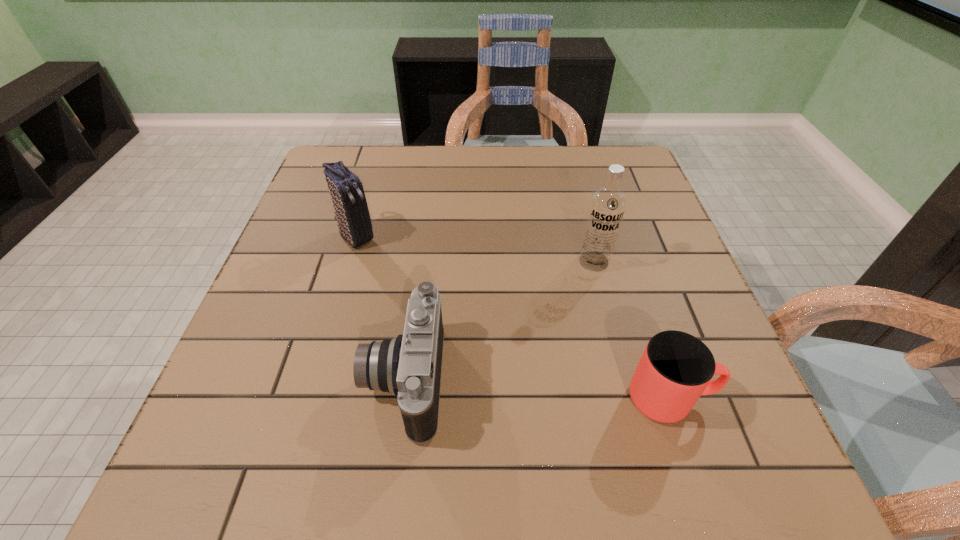
The width and height of the screenshot is (960, 540). Find the location of `free space that is in between the tallest object and the cup`. free space that is in between the tallest object and the cup is located at coordinates (632, 330).

Identify the location of free point between the leftmost object and the shortest object. (514, 318).

Find the location of a particular element. free spot between the third object from right to left and the leftmost object is located at coordinates 380,308.

At what (x,y) coordinates should I click in order to perform the action: click on free point between the second object from left to right and the second tallest object. Please return your answer as a coordinate pair (x, y). Image resolution: width=960 pixels, height=540 pixels. Looking at the image, I should click on (380, 308).

Where is `vacant point located between the tallest object and the clutch bag`? The width and height of the screenshot is (960, 540). vacant point located between the tallest object and the clutch bag is located at coordinates (475, 249).

The width and height of the screenshot is (960, 540). Identify the location of vacant area that lies between the second object from left to right and the third shortest object. (380, 308).

At what (x,y) coordinates should I click in order to perform the action: click on vacant space that's between the third shortest object and the shortest object. Please return your answer as a coordinate pair (x, y). Looking at the image, I should click on (514, 318).

Locate which object is the second closest to the second shortest object. Please provide its 2D coordinates. Your answer should be formatted as a tuple, i.e. [(x, y)], where the tuple contains the x and y coordinates of a point satisfying the conditions above.

[(607, 206)]

Where is `object that stands as the third closest to the third object from right to left`? object that stands as the third closest to the third object from right to left is located at coordinates (676, 368).

Where is `free space in the image that satisfies the following two spatial constraints: 1. on the front side of the second shortest object; 2. on the front-facing side of the third shortest object`? The image size is (960, 540). free space in the image that satisfies the following two spatial constraints: 1. on the front side of the second shortest object; 2. on the front-facing side of the third shortest object is located at coordinates (315, 380).